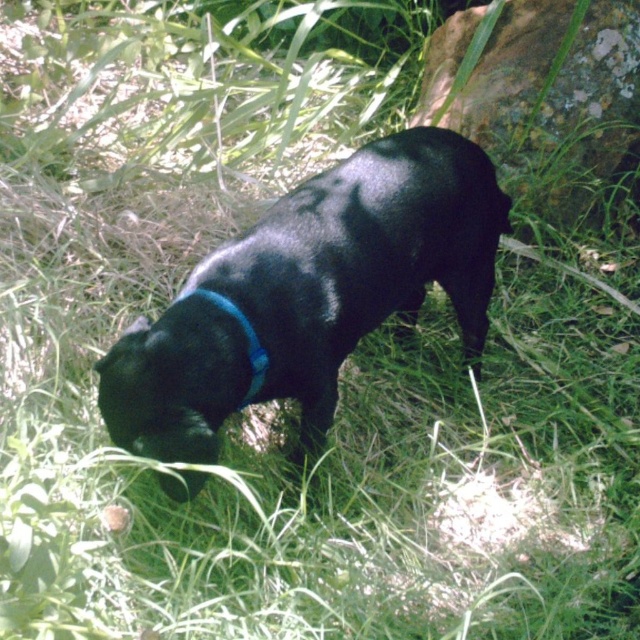
Question: Is shiny black dog at center behind blue fabric neckband at center?

Choices:
 (A) yes
 (B) no

Answer: (B)

Question: Is shiny black dog at center wider than blue fabric neckband at center?

Choices:
 (A) no
 (B) yes

Answer: (B)

Question: Which point is closer to the camera?

Choices:
 (A) (301, 349)
 (B) (252, 381)

Answer: (B)

Question: Can you confirm if shiny black dog at center is thinner than blue fabric neckband at center?

Choices:
 (A) no
 (B) yes

Answer: (A)

Question: Which object is farther from the camera taking this photo?

Choices:
 (A) blue fabric neckband at center
 (B) shiny black dog at center

Answer: (A)

Question: Which point is closer to the camera?

Choices:
 (A) (292, 198)
 (B) (244, 401)

Answer: (B)